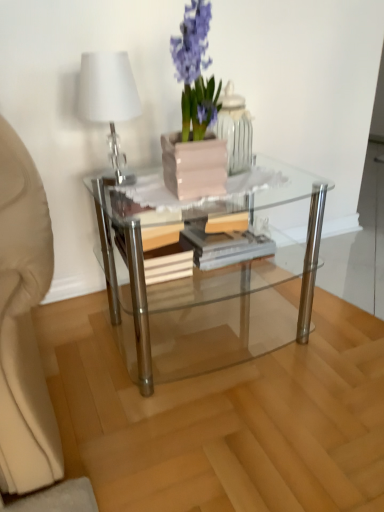
Identify the location of vacant space in front of transparent glass coffee table at center. (216, 429).